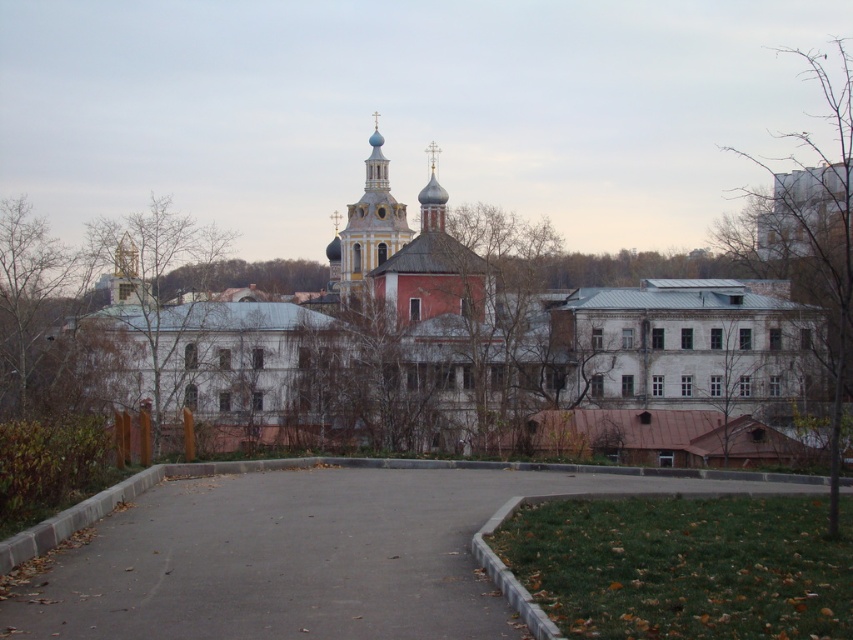
Question: Does brown wood tree at left appear on the left side of brown wooden tree at center?

Choices:
 (A) no
 (B) yes

Answer: (B)

Question: Which of the following is the farthest from the observer?

Choices:
 (A) (434, 161)
 (B) (566, 483)

Answer: (A)

Question: Does gray concrete path at center have a larger size compared to bare branches at upper right?

Choices:
 (A) no
 (B) yes

Answer: (A)

Question: Considering the real-world distances, which object is farthest from the brown wood tree at left?

Choices:
 (A) bare branches at upper right
 (B) gold textured dome at center

Answer: (A)

Question: Which object appears farthest from the camera in this image?

Choices:
 (A) bare branches at upper right
 (B) gray concrete path at center
 (C) brown wooden tree at center
 (D) gold textured dome at center

Answer: (D)

Question: Is brown wooden tree at center bigger than gold textured dome at center?

Choices:
 (A) yes
 (B) no

Answer: (A)